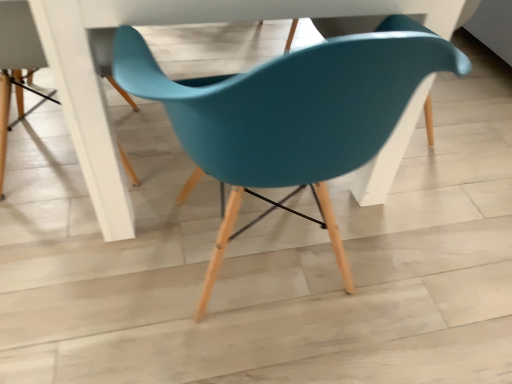
Question: Does point (8, 41) appear closer or farther from the camera than point (201, 89)?

Choices:
 (A) closer
 (B) farther

Answer: (B)

Question: Considering the positions of teal plastic chair at upper center, which ranks as the 1th chair in left-to-right order, and teal plastic chair at center, which is the 2th chair in left-to-right order, in the image, is teal plastic chair at upper center, which ranks as the 1th chair in left-to-right order, taller or shorter than teal plastic chair at center, which is the 2th chair in left-to-right order,?

Choices:
 (A) short
 (B) tall

Answer: (A)

Question: From the image's perspective, is teal plastic chair at upper center, which ranks as the 1th chair in left-to-right order, positioned above or below teal plastic chair at center, the first chair in the right-to-left sequence?

Choices:
 (A) below
 (B) above

Answer: (B)

Question: Is point (320, 198) closer or farther from the camera than point (2, 84)?

Choices:
 (A) farther
 (B) closer

Answer: (B)

Question: Is teal plastic chair at center, the first chair in the right-to-left sequence, bigger or smaller than teal plastic chair at upper center, which ranks as the 1th chair in left-to-right order?

Choices:
 (A) big
 (B) small

Answer: (A)

Question: From a real-world perspective, is teal plastic chair at center, the first chair in the right-to-left sequence, positioned above or below teal plastic chair at upper center, which ranks as the 1th chair in left-to-right order?

Choices:
 (A) above
 (B) below

Answer: (A)

Question: Considering the positions of teal plastic chair at center, the first chair in the right-to-left sequence, and teal plastic chair at upper center, acting as the second chair starting from the right, in the image, is teal plastic chair at center, the first chair in the right-to-left sequence, wider or thinner than teal plastic chair at upper center, acting as the second chair starting from the right,?

Choices:
 (A) thin
 (B) wide

Answer: (B)